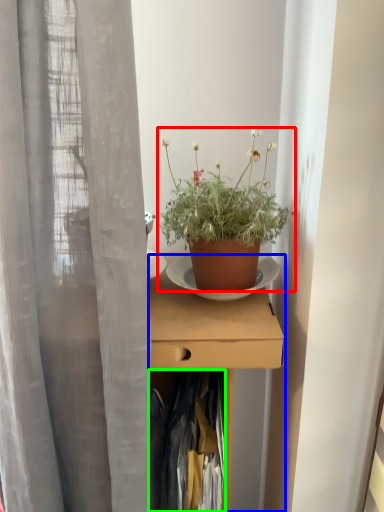
Question: Based on their relative distances, which object is nearer to houseplant (highlighted by a red box)? Choose from desk (highlighted by a blue box) and clothing (highlighted by a green box).

Choices:
 (A) desk
 (B) clothing

Answer: (A)